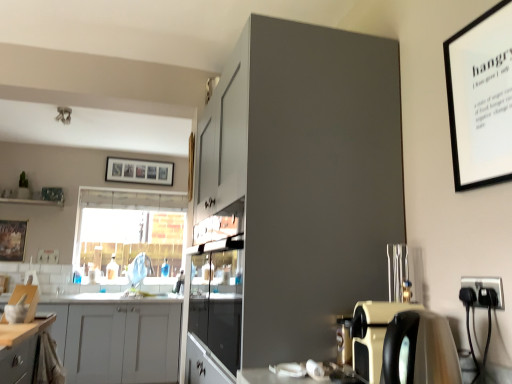
Locate an element on the screen. black plastic electrical outlet at lower right is located at coordinates (485, 287).

Measure the distance between point [494,285] and camera.

Point [494,285] and camera are 3.69 feet apart from each other.

Describe the element at coordinates (402, 335) in the screenshot. This screenshot has width=512, height=384. I see `matte black coffee machine at lower right` at that location.

How much space does matte gray cabinet at upper center, which appears as the 1th cabinetry when viewed from the front, occupy horizontally?

matte gray cabinet at upper center, which appears as the 1th cabinetry when viewed from the front, is 24.94 inches wide.

Find the location of a particular element. This screenshot has height=384, width=512. white matte cabinet at lower left, the 2th cabinetry in the front-to-back sequence is located at coordinates (118, 340).

Measure the distance between point [238,359] and camera.

Point [238,359] is 1.31 meters from camera.

Where is `wooden framed artwork at left, the 1th picture frame when ordered from bottom to top`? wooden framed artwork at left, the 1th picture frame when ordered from bottom to top is located at coordinates (12, 240).

Is translucent glass bottle at center inside the boundaries of matte black coffee machine at lower right, or outside?

translucent glass bottle at center is outside matte black coffee machine at lower right.

Would you consider translucent glass bottle at center to be distant from matte black coffee machine at lower right?

Yes, translucent glass bottle at center and matte black coffee machine at lower right are quite far apart.

From the image's perspective, is translucent glass bottle at center located above matte black coffee machine at lower right?

No, from the image's perspective, translucent glass bottle at center is not over matte black coffee machine at lower right.

Can you confirm if translucent glass bottle at center is thinner than matte black coffee machine at lower right?

Yes, translucent glass bottle at center is thinner than matte black coffee machine at lower right.

From the image's perspective, which one is positioned higher, matte gray cabinet at upper center, which ranks as the 1th cabinetry in top-to-bottom order, or black plastic electrical outlet at lower right?

matte gray cabinet at upper center, which ranks as the 1th cabinetry in top-to-bottom order, is shown above in the image.

Looking at this image, is matte gray cabinet at upper center, which ranks as the 1th cabinetry in top-to-bottom order, in front of or behind black plastic electrical outlet at lower right in the image?

Clearly, matte gray cabinet at upper center, which ranks as the 1th cabinetry in top-to-bottom order, is behind black plastic electrical outlet at lower right.

In the image, there is a black plastic electrical outlet at lower right. Where is `cabinetry above it (from the image's perspective)`? The height and width of the screenshot is (384, 512). cabinetry above it (from the image's perspective) is located at coordinates (293, 193).

Considering the sizes of objects matte gray cabinet at upper center, acting as the second cabinetry starting from the left, and black plastic electrical outlet at lower right in the image provided, who is wider, matte gray cabinet at upper center, acting as the second cabinetry starting from the left, or black plastic electrical outlet at lower right?

Wider between the two is matte gray cabinet at upper center, acting as the second cabinetry starting from the left.

Is matte gray cabinet at upper center, the second cabinetry positioned from the bottom, aimed at wooden photo frame at upper center, placed as the first picture frame when sorted from right to left?

No, matte gray cabinet at upper center, the second cabinetry positioned from the bottom, is not aimed at wooden photo frame at upper center, placed as the first picture frame when sorted from right to left.

From a real-world perspective, is matte gray cabinet at upper center, the second cabinetry positioned from the bottom, on top of wooden photo frame at upper center, the 2th picture frame ordered from the bottom?

Actually, matte gray cabinet at upper center, the second cabinetry positioned from the bottom, is physically below wooden photo frame at upper center, the 2th picture frame ordered from the bottom, in the real world.

How distant is matte gray cabinet at upper center, acting as the second cabinetry starting from the left, from wooden photo frame at upper center, the 1th picture frame viewed from the back?

The distance of matte gray cabinet at upper center, acting as the second cabinetry starting from the left, from wooden photo frame at upper center, the 1th picture frame viewed from the back, is 3.37 meters.

Which of these two, clear glass window at center or wooden framed artwork at left, which appears as the 2th picture frame when viewed from the right, is thinner?

wooden framed artwork at left, which appears as the 2th picture frame when viewed from the right.

Is clear glass window at center bigger or smaller than wooden framed artwork at left, which appears as the 2th picture frame when viewed from the right?

Clearly, clear glass window at center is larger in size than wooden framed artwork at left, which appears as the 2th picture frame when viewed from the right.

Is wooden framed artwork at left, arranged as the first picture frame when viewed from the left, located within clear glass window at center?

That's incorrect, wooden framed artwork at left, arranged as the first picture frame when viewed from the left, is not inside clear glass window at center.

Can you confirm if transparent glass cabinet at center is positioned to the right of white matte cabinet at lower left, the 1th cabinetry when ordered from back to front?

Indeed, transparent glass cabinet at center is positioned on the right side of white matte cabinet at lower left, the 1th cabinetry when ordered from back to front.

Is point (202, 378) positioned after point (78, 381)?

No.

Measure the distance from transparent glass cabinet at center to white matte cabinet at lower left, the second cabinetry viewed from the top.

2.01 meters.

Is transparent glass cabinet at center aimed at white matte cabinet at lower left, acting as the 1th cabinetry starting from the left?

No.

From a real-world perspective, is black plastic electrical outlet at lower right positioned over wooden photo frame at upper center, placed as the second picture frame when sorted from left to right, based on gravity?

No.

At what (x,y) coordinates should I click in order to perform the action: click on the 2nd picture frame behind when counting from the black plastic electrical outlet at lower right. Please return your answer as a coordinate pair (x, y). Looking at the image, I should click on (139, 171).

Does black plastic electrical outlet at lower right turn towards wooden photo frame at upper center, placed as the second picture frame when sorted from left to right?

No, black plastic electrical outlet at lower right is not aimed at wooden photo frame at upper center, placed as the second picture frame when sorted from left to right.

Consider the image. From the image's perspective, does black plastic electrical outlet at lower right appear lower than wooden photo frame at upper center, which is the 2th picture frame from front to back?

Yes, from the image's perspective, black plastic electrical outlet at lower right is below wooden photo frame at upper center, which is the 2th picture frame from front to back.

This screenshot has height=384, width=512. Find the location of `window behind the translucent glass bottle at center`. window behind the translucent glass bottle at center is located at coordinates (130, 229).

Would you say translucent glass bottle at center is a long distance from clear glass window at center?

That's not correct — translucent glass bottle at center is a little close to clear glass window at center.

Is translucent glass bottle at center spatially inside clear glass window at center, or outside of it?

The correct answer is: outside.

Is point (110, 279) positioned in front of point (136, 241)?

Yes, point (110, 279) is closer to viewer.

In the image, there is a translucent glass bottle at center. At what (x,y) coordinates should I click in order to perform the action: click on coffee machine above it (from the image's perspective). Please return your answer as a coordinate pair (x, y). Image resolution: width=512 pixels, height=384 pixels. Looking at the image, I should click on (402, 335).

Locate an element on the screen. The width and height of the screenshot is (512, 384). cabinetry that is the 1st object located behind the black plastic electrical outlet at lower right is located at coordinates (293, 193).

Considering their positions, is matte gray cabinet at upper center, which ranks as the 1th cabinetry in top-to-bottom order, positioned further to clear glass window at center than transparent glass cabinet at center?

Based on the image, matte gray cabinet at upper center, which ranks as the 1th cabinetry in top-to-bottom order, appears to be further to clear glass window at center.

Based on the photo, considering their positions, is matte gray cabinet at upper center, acting as the second cabinetry starting from the left, positioned closer to clear glass window at center than black plastic electrical outlet at lower right?

matte gray cabinet at upper center, acting as the second cabinetry starting from the left, lies closer to clear glass window at center than the other object.

Estimate the real-world distances between objects in this image. Which object is further from matte gray cabinet at upper center, which ranks as the 1th cabinetry in top-to-bottom order, translucent glass bottle at center or matte black coffee machine at lower right?

Based on the image, translucent glass bottle at center appears to be further to matte gray cabinet at upper center, which ranks as the 1th cabinetry in top-to-bottom order.

Estimate the real-world distances between objects in this image. Which object is further from wooden framed artwork at left, which appears as the 2th picture frame when viewed from the right, matte black coffee machine at lower right or wooden photo frame at upper center, which is the 2th picture frame from front to back?

matte black coffee machine at lower right.

Estimate the real-world distances between objects in this image. Which object is further from wooden framed artwork at left, the 1th picture frame from the front, clear glass window at center or wooden photo frame at upper center, the 2th picture frame ordered from the bottom?

wooden photo frame at upper center, the 2th picture frame ordered from the bottom, lies further to wooden framed artwork at left, the 1th picture frame from the front, than the other object.

Which object lies nearer to the anchor point wooden photo frame at upper center, which is the 2th picture frame from front to back, wooden framed artwork at left, the 1th picture frame when ordered from bottom to top, or matte black coffee machine at lower right?

Based on the image, wooden framed artwork at left, the 1th picture frame when ordered from bottom to top, appears to be nearer to wooden photo frame at upper center, which is the 2th picture frame from front to back.

Based on their spatial positions, is black plastic electrical outlet at lower right or transparent glass cabinet at center closer to clear glass window at center?

Among the two, transparent glass cabinet at center is located nearer to clear glass window at center.

When comparing their distances from matte black coffee machine at lower right, does clear glass window at center or transparent glass cabinet at center seem closer?

The object closer to matte black coffee machine at lower right is transparent glass cabinet at center.

Where is `picture frame positioned between matte black coffee machine at lower right and wooden photo frame at upper center, which is the 2th picture frame from front to back, from near to far`? Image resolution: width=512 pixels, height=384 pixels. picture frame positioned between matte black coffee machine at lower right and wooden photo frame at upper center, which is the 2th picture frame from front to back, from near to far is located at coordinates (12, 240).

You are a GUI agent. You are given a task and a screenshot of the screen. Output one action in this format:
    pyautogui.click(x=<x>, y=<y>)
    Task: Click on the cabinetry between transparent glass cabinet at center and translucent glass bottle at center along the z-axis
    
    Given the screenshot: What is the action you would take?
    pyautogui.click(x=118, y=340)

Locate an element on the screen. picture frame between matte gray cabinet at upper center, positioned as the second cabinetry in back-to-front order, and clear glass window at center in the front-back direction is located at coordinates coord(12,240).

The height and width of the screenshot is (384, 512). What are the coordinates of `picture frame positioned between black plastic electrical outlet at lower right and translucent glass bottle at center from near to far` in the screenshot? It's located at (12, 240).